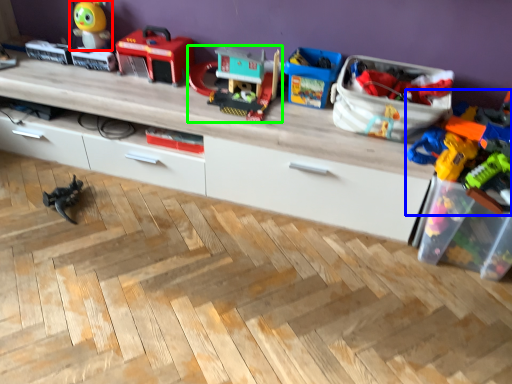
Question: Which object is positioned closest to toy (highlighted by a red box)? Select from toy (highlighted by a blue box) and toy (highlighted by a green box).

Choices:
 (A) toy
 (B) toy

Answer: (B)